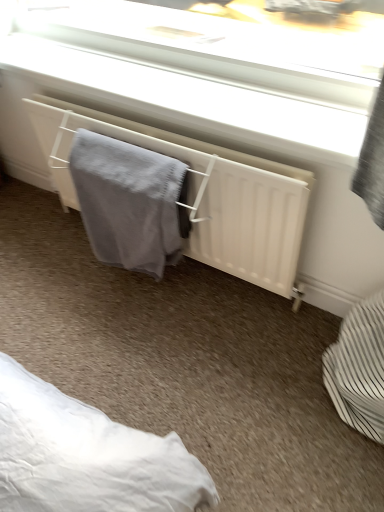
Question: Can you confirm if white matte radiator at center is shorter than white striped basket at lower right?

Choices:
 (A) yes
 (B) no

Answer: (A)

Question: Is white matte radiator at center closer to camera compared to white striped basket at lower right?

Choices:
 (A) no
 (B) yes

Answer: (A)

Question: From a real-world perspective, is white matte radiator at center positioned over white striped basket at lower right based on gravity?

Choices:
 (A) yes
 (B) no

Answer: (A)

Question: Does white matte radiator at center have a lesser width compared to white striped basket at lower right?

Choices:
 (A) yes
 (B) no

Answer: (A)

Question: Is white striped basket at lower right completely or partially inside white matte radiator at center?

Choices:
 (A) no
 (B) yes

Answer: (A)

Question: Is white striped basket at lower right in front of or behind gray knitted towel at center in the image?

Choices:
 (A) front
 (B) behind

Answer: (A)

Question: Is white striped basket at lower right spatially inside gray knitted towel at center, or outside of it?

Choices:
 (A) inside
 (B) outside

Answer: (B)

Question: From the image's perspective, is white striped basket at lower right positioned above or below gray knitted towel at center?

Choices:
 (A) below
 (B) above

Answer: (A)

Question: From a real-world perspective, is white striped basket at lower right physically located above or below gray knitted towel at center?

Choices:
 (A) above
 (B) below

Answer: (B)

Question: Is gray knitted towel at center taller or shorter than white matte radiator at center?

Choices:
 (A) tall
 (B) short

Answer: (A)

Question: Visually, is gray knitted towel at center positioned to the left or to the right of white matte radiator at center?

Choices:
 (A) right
 (B) left

Answer: (B)

Question: From a real-world perspective, relative to white matte radiator at center, is gray knitted towel at center vertically above or below?

Choices:
 (A) above
 (B) below

Answer: (B)

Question: Is gray knitted towel at center wider or thinner than white matte radiator at center?

Choices:
 (A) wide
 (B) thin

Answer: (B)

Question: Does point (254, 233) appear closer or farther from the camera than point (357, 327)?

Choices:
 (A) closer
 (B) farther

Answer: (B)

Question: Based on their positions, is white matte radiator at center located to the left or right of white striped basket at lower right?

Choices:
 (A) left
 (B) right

Answer: (A)